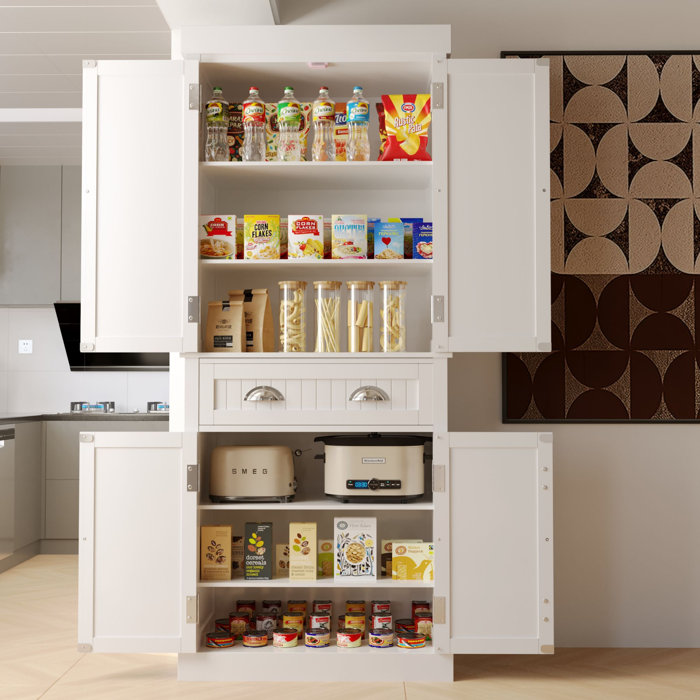
The image size is (700, 700). Identify the location of containers of dried noodles. (388, 315), (354, 318), (322, 322), (290, 322).